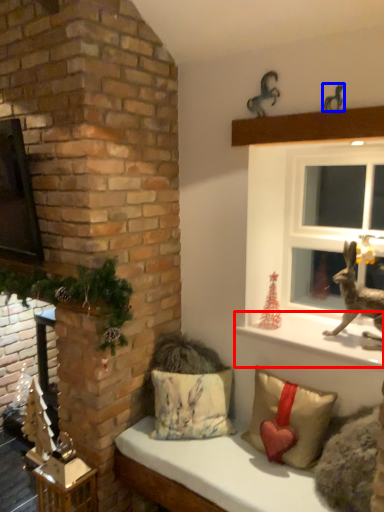
Question: Which point is further to the camera, window sill (highlighted by a red box) or animal (highlighted by a blue box)?

Choices:
 (A) window sill
 (B) animal

Answer: (A)